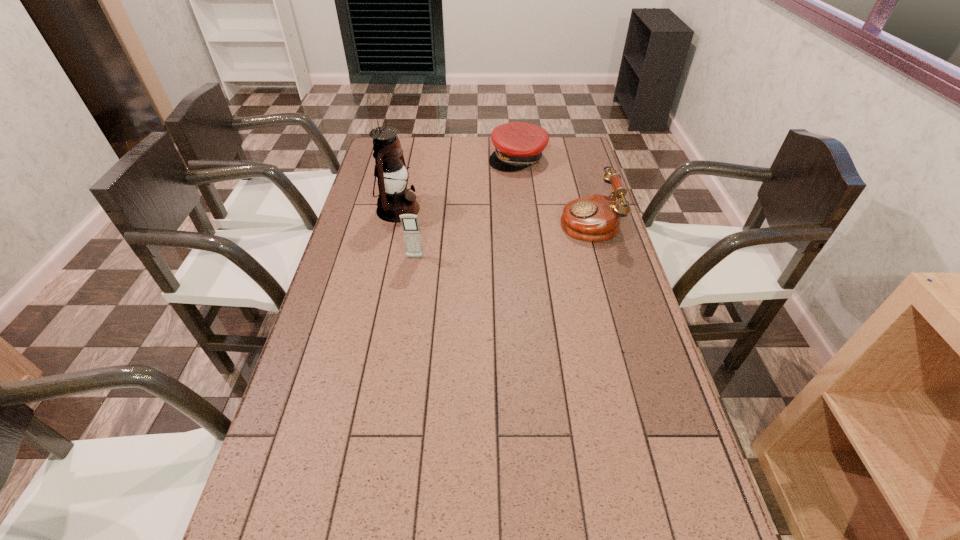
The width and height of the screenshot is (960, 540). What are the coordinates of `vacant space on the desktop that is between the cellular telephone and the rightmost object and is positioned on the front-facing side of the third object from left to right` in the screenshot? It's located at (519, 235).

Where is `free space on the desktop that is between the cellular telephone and the telephone and is positioned on the side of the lantern, there is a wick adjustment knob`? free space on the desktop that is between the cellular telephone and the telephone and is positioned on the side of the lantern, there is a wick adjustment knob is located at coordinates click(523, 234).